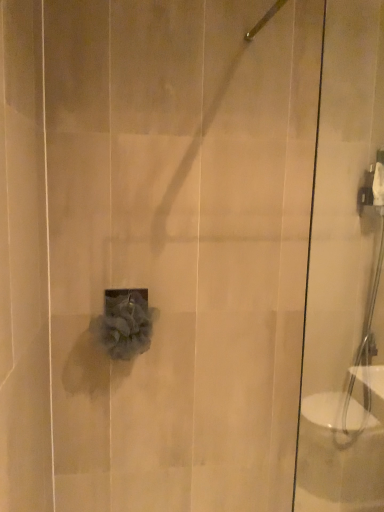
This screenshot has height=512, width=384. What do you see at coordinates (346, 274) in the screenshot? I see `transparent glass shower door at right` at bounding box center [346, 274].

At what (x,y) coordinates should I click in order to perform the action: click on satin nickel showerhead at upper center. Please return your answer as a coordinate pair (x, y). Looking at the image, I should click on (264, 20).

Is point (146, 291) closer to camera compared to point (357, 5)?

That is False.

From a real-world perspective, which is physically above, gray fluffy loofah at center or transparent glass shower door at right?

transparent glass shower door at right is physically above.

Consider the image. Is gray fluffy loofah at center bigger or smaller than transparent glass shower door at right?

In the image, gray fluffy loofah at center appears to be smaller than transparent glass shower door at right.

How far apart are gray fluffy loofah at center and transparent glass shower door at right?

gray fluffy loofah at center and transparent glass shower door at right are 30.47 inches apart.

Is gray fluffy loofah at center taller than satin nickel showerhead at upper center?

Indeed, gray fluffy loofah at center has a greater height compared to satin nickel showerhead at upper center.

From the image's perspective, is gray fluffy loofah at center above or below satin nickel showerhead at upper center?

From the image's perspective, gray fluffy loofah at center appears below satin nickel showerhead at upper center.

Between gray fluffy loofah at center and satin nickel showerhead at upper center, which one has larger width?

Wider between the two is satin nickel showerhead at upper center.

Is there a large distance between gray fluffy loofah at center and satin nickel showerhead at upper center?

No, there isn't a large distance between gray fluffy loofah at center and satin nickel showerhead at upper center.

Can you confirm if satin nickel showerhead at upper center is shorter than transparent glass shower door at right?

Correct, satin nickel showerhead at upper center is not as tall as transparent glass shower door at right.

From the image's perspective, is satin nickel showerhead at upper center above or below transparent glass shower door at right?

satin nickel showerhead at upper center is above transparent glass shower door at right.

Could you tell me if satin nickel showerhead at upper center is turned towards transparent glass shower door at right?

No, satin nickel showerhead at upper center is not oriented towards transparent glass shower door at right.

Looking at their sizes, would you say satin nickel showerhead at upper center is wider or thinner than transparent glass shower door at right?

satin nickel showerhead at upper center is wider than transparent glass shower door at right.

Choose the correct answer: Is transparent glass shower door at right inside gray fluffy loofah at center or outside it?

transparent glass shower door at right is spatially situated outside gray fluffy loofah at center.

Consider the image. Considering their positions, is transparent glass shower door at right located in front of or behind gray fluffy loofah at center?

Clearly, transparent glass shower door at right is in front of gray fluffy loofah at center.

Measure the distance from transparent glass shower door at right to gray fluffy loofah at center.

The distance of transparent glass shower door at right from gray fluffy loofah at center is 30.47 inches.

Is point (327, 495) positioned in front of point (133, 327)?

No, (327, 495) is further to viewer.

Considering the relative positions of satin nickel showerhead at upper center and gray fluffy loofah at center in the image provided, is satin nickel showerhead at upper center in front of gray fluffy loofah at center?

Yes.

Who is taller, satin nickel showerhead at upper center or gray fluffy loofah at center?

gray fluffy loofah at center is taller.

Does point (249, 33) come closer to viewer compared to point (129, 296)?

Yes, point (249, 33) is closer to viewer.

From the image's perspective, is transparent glass shower door at right positioned above or below satin nickel showerhead at upper center?

transparent glass shower door at right is below satin nickel showerhead at upper center.

Is transparent glass shower door at right facing away from satin nickel showerhead at upper center?

That's not correct — transparent glass shower door at right is not looking away from satin nickel showerhead at upper center.

Considering the points (351, 426) and (258, 21), which point is behind, point (351, 426) or point (258, 21)?

Positioned behind is point (351, 426).

From a real-world perspective, which is physically below, transparent glass shower door at right or satin nickel showerhead at upper center?

transparent glass shower door at right.

What are the coordinates of `flower below the transparent glass shower door at right (from a real-world perspective)` in the screenshot? It's located at (124, 323).

At what (x,y) coordinates should I click in order to perform the action: click on flower below the satin nickel showerhead at upper center (from the image's perspective). Please return your answer as a coordinate pair (x, y). The height and width of the screenshot is (512, 384). Looking at the image, I should click on (124, 323).

Which object lies nearer to the anchor point satin nickel showerhead at upper center, gray fluffy loofah at center or transparent glass shower door at right?

transparent glass shower door at right is positioned closer to the anchor satin nickel showerhead at upper center.

From the image, which object appears to be nearer to gray fluffy loofah at center, satin nickel showerhead at upper center or transparent glass shower door at right?

transparent glass shower door at right is positioned closer to the anchor gray fluffy loofah at center.

Estimate the real-world distances between objects in this image. Which object is closer to satin nickel showerhead at upper center, transparent glass shower door at right or gray fluffy loofah at center?

transparent glass shower door at right is positioned closer to the anchor satin nickel showerhead at upper center.

From the image, which object appears to be nearer to transparent glass shower door at right, gray fluffy loofah at center or satin nickel showerhead at upper center?

The object closer to transparent glass shower door at right is gray fluffy loofah at center.

Estimate the real-world distances between objects in this image. Which object is closer to gray fluffy loofah at center, transparent glass shower door at right or satin nickel showerhead at upper center?

transparent glass shower door at right.

Consider the image. Based on their spatial positions, is satin nickel showerhead at upper center or gray fluffy loofah at center closer to transparent glass shower door at right?

gray fluffy loofah at center lies closer to transparent glass shower door at right than the other object.

Where is `shower door between satin nickel showerhead at upper center and gray fluffy loofah at center in the up-down direction`? shower door between satin nickel showerhead at upper center and gray fluffy loofah at center in the up-down direction is located at coordinates (346, 274).